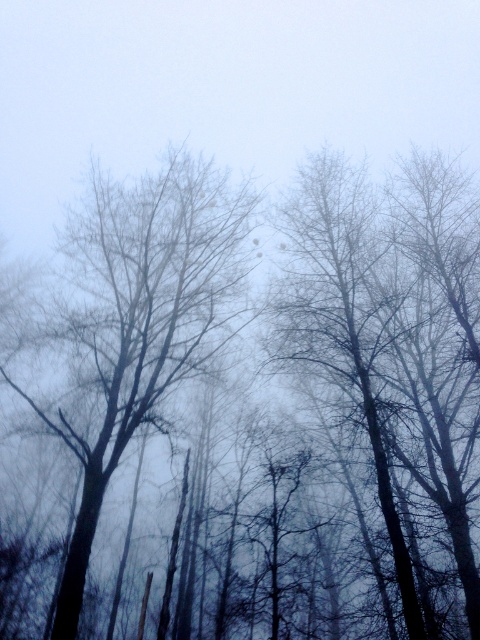
Question: Which object appears closest to the camera in this image?

Choices:
 (A) bare branches at center
 (B) dark brown bark tree at center

Answer: (B)

Question: Can you confirm if dark brown bark tree at center is smaller than bare branches at center?

Choices:
 (A) yes
 (B) no

Answer: (B)

Question: Considering the relative positions of dark brown bark tree at center and bare branches at center in the image provided, where is dark brown bark tree at center located with respect to bare branches at center?

Choices:
 (A) below
 (B) above

Answer: (B)

Question: Observing the image, what is the correct spatial positioning of dark brown bark tree at center in reference to bare branches at center?

Choices:
 (A) left
 (B) right

Answer: (B)